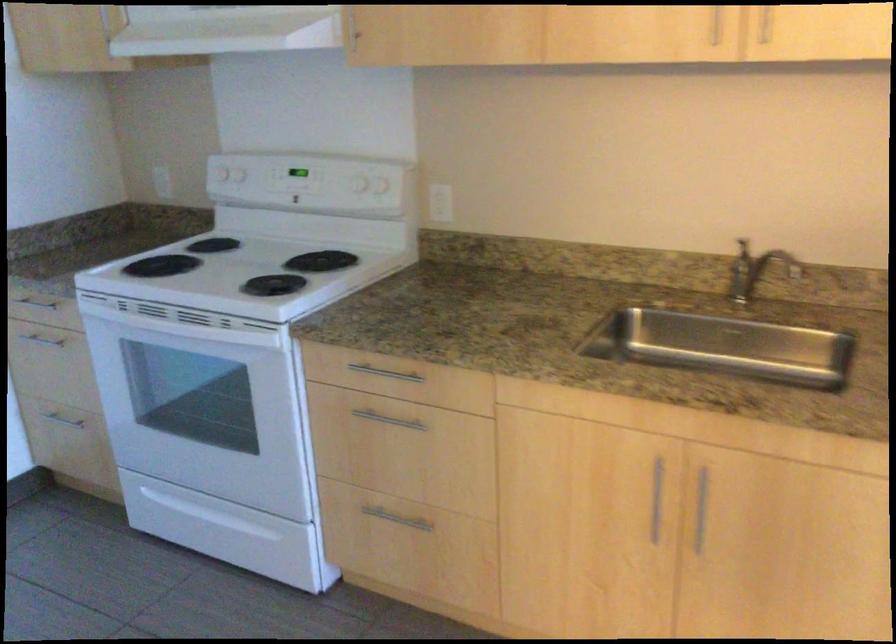
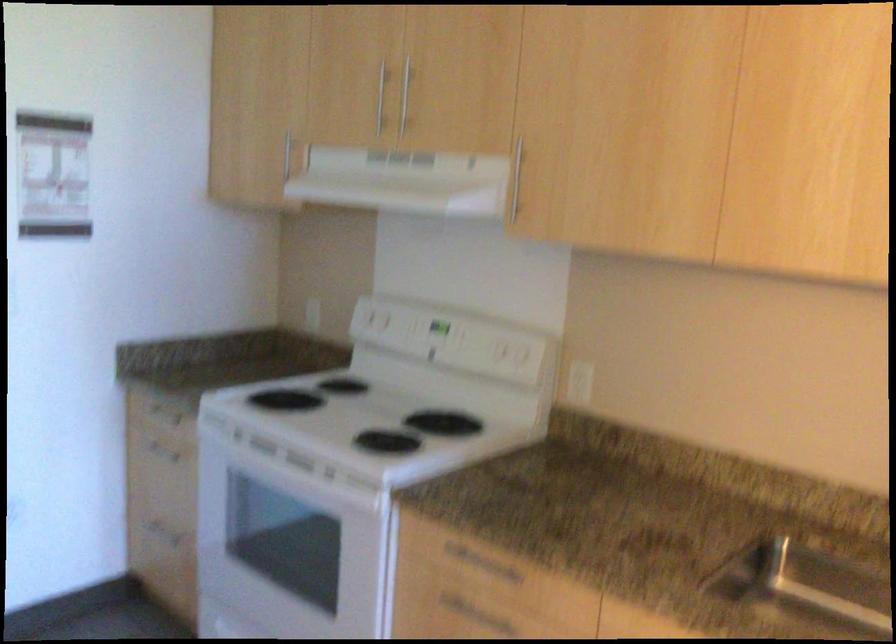
The point at (375, 415) is marked in the first image. Where is the corresponding point in the second image?

(466, 609)